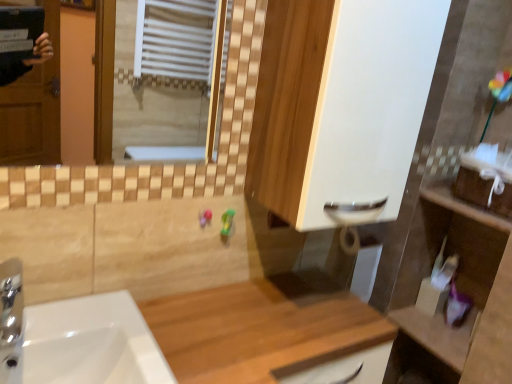
You are a GUI agent. You are given a task and a screenshot of the screen. Output one action in this format:
    pyautogui.click(x=<x>, y=<y>)
    Task: Click on the spots to the right of chrome metallic tap at lower left
    The height and width of the screenshot is (384, 512).
    Given the screenshot: What is the action you would take?
    pyautogui.click(x=100, y=337)